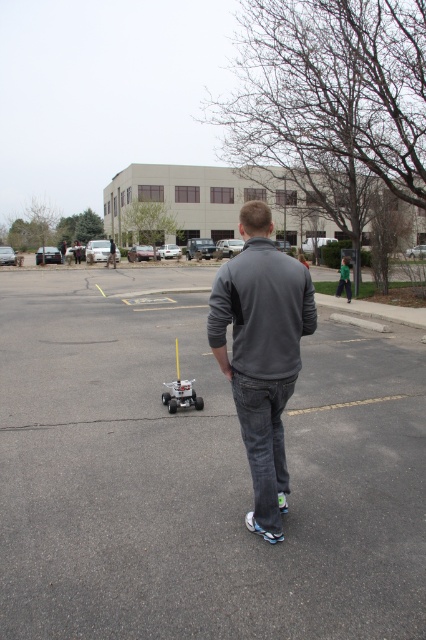
You are standing in the parking lot and see the gray asphalt parking lot at center and the white plastic toy at center. Which object is closer to you?

The gray asphalt parking lot at center is closer to you because it is in front of the white plastic toy at center.